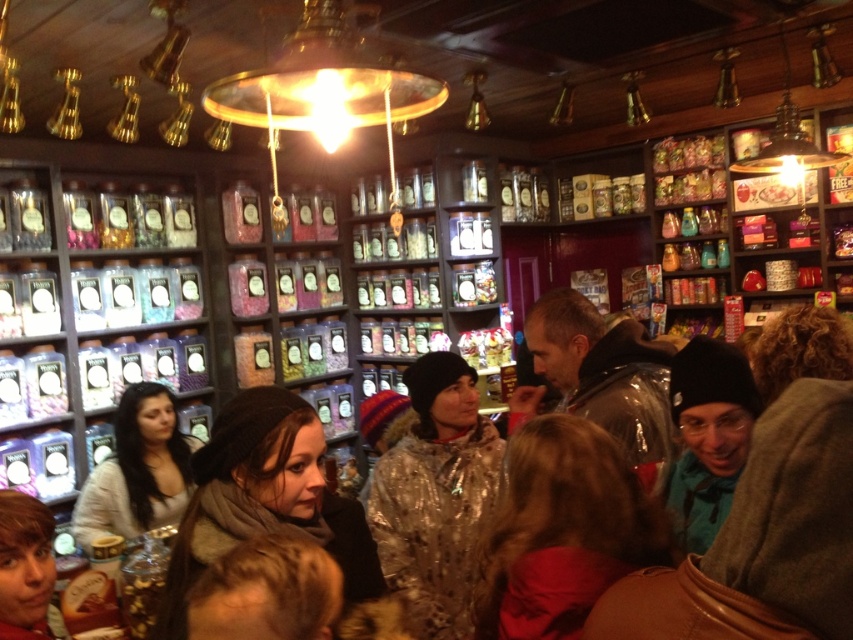
Question: Is shiny metallic jacket at center above sparkly silver jacket at center?

Choices:
 (A) yes
 (B) no

Answer: (A)

Question: Which object appears farthest from the camera in this image?

Choices:
 (A) knitted sweater at center
 (B) smooth brown hair at lower left
 (C) dark brown knit hat at center
 (D) shiny metallic jacket at center

Answer: (A)

Question: Among these objects, which one is nearest to the camera?

Choices:
 (A) shiny brown hair at lower center
 (B) shiny metallic jacket at center
 (C) dark brown knit hat at center
 (D) smooth brown hair at lower left

Answer: (A)

Question: Is shiny metallic jacket at center above sparkly silver jacket at center?

Choices:
 (A) yes
 (B) no

Answer: (A)

Question: Which of the following is the closest to the observer?

Choices:
 (A) smooth brown hair at lower left
 (B) dark brown knit hat at center

Answer: (B)

Question: From the image, what is the correct spatial relationship of dark brown knit hat at center in relation to smooth brown hair at lower left?

Choices:
 (A) right
 (B) left

Answer: (A)